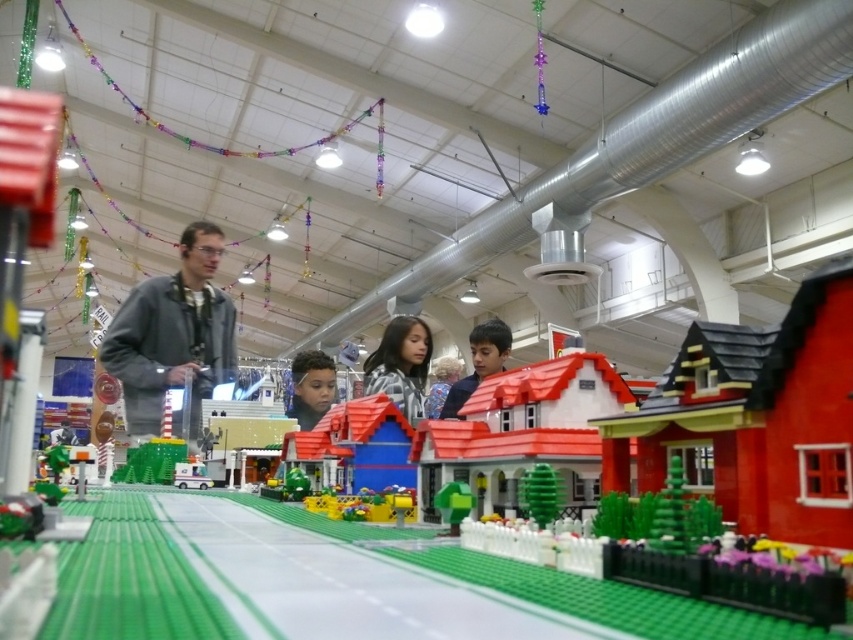
Which of these two, gray matte jacket at upper left or matte black hair at center, stands taller?

With more height is gray matte jacket at upper left.

Between point (171, 321) and point (299, 355), which one is positioned in front?

Point (171, 321) is more forward.

Between point (195, 308) and point (303, 358), which one is positioned behind?

Point (303, 358)

Find the location of a particular element. gray matte jacket at upper left is located at coordinates (173, 333).

Which is above, plaid shirt at center or smooth brown hair at center?

plaid shirt at center is above.

Does plaid shirt at center come behind smooth brown hair at center?

No, plaid shirt at center is in front of smooth brown hair at center.

Describe the element at coordinates (399, 364) in the screenshot. I see `plaid shirt at center` at that location.

At what (x,y) coordinates should I click in order to perform the action: click on plaid shirt at center. Please return your answer as a coordinate pair (x, y). Image resolution: width=853 pixels, height=640 pixels. Looking at the image, I should click on (399, 364).

Is plaid shirt at center shorter than matte black hair at center?

No, plaid shirt at center is not shorter than matte black hair at center.

Is plaid shirt at center taller than matte black hair at center?

Correct, plaid shirt at center is much taller as matte black hair at center.

Is point (416, 396) positioned behind point (305, 426)?

No, (416, 396) is closer to viewer.

The height and width of the screenshot is (640, 853). I want to click on plaid shirt at center, so click(399, 364).